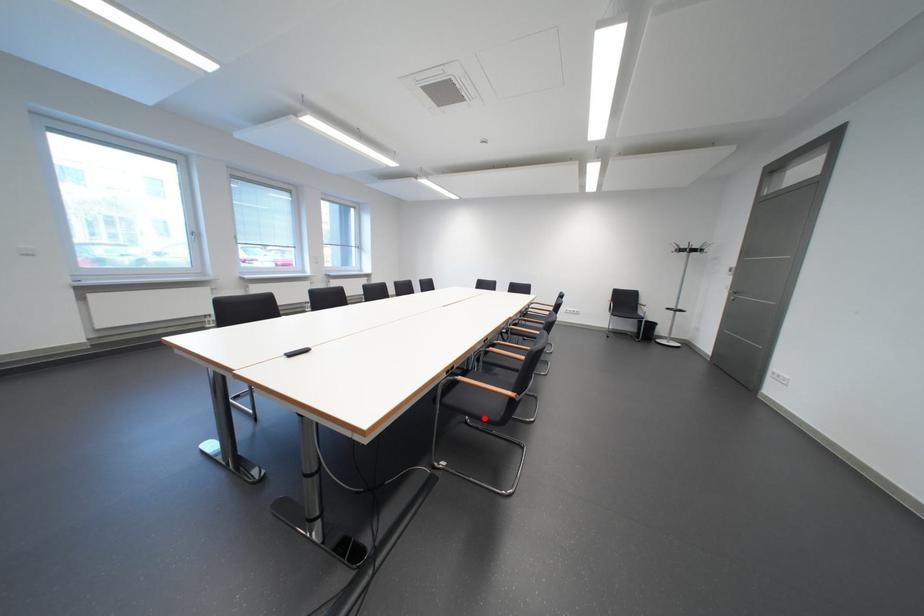
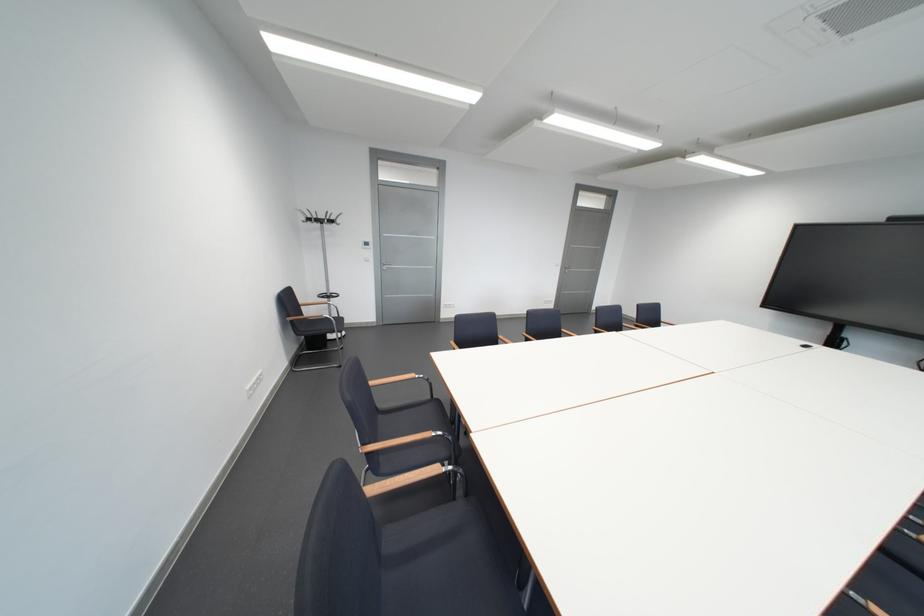
Question: I am providing you with two images of the same scene from different viewpoints. A red point is marked on the first image. Can you still see the location of the red point in image 2?

Choices:
 (A) Yes
 (B) No

Answer: (B)